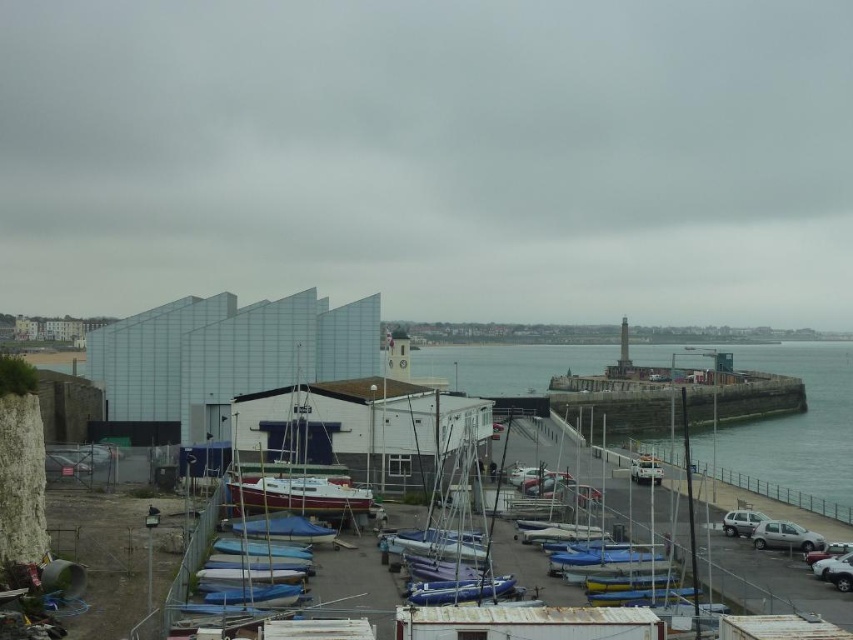
Question: Which point is farther to the camera?

Choices:
 (A) white matte sailboat at center
 (B) clear blue water at center

Answer: (B)

Question: Is white matte sailboat at center bigger than white matte van at center?

Choices:
 (A) no
 (B) yes

Answer: (B)

Question: Does blue plastic sailboat at center come behind silver metallic car at lower right?

Choices:
 (A) no
 (B) yes

Answer: (A)

Question: Estimate the real-world distances between objects in this image. Which object is farther from the satin silver suv at lower right?

Choices:
 (A) white matte sailboat at center
 (B) silver metallic car at lower right

Answer: (A)

Question: Among these objects, which one is nearest to the camera?

Choices:
 (A) white matte van at center
 (B) satin silver suv at lower right
 (C) white matte sailboat at center

Answer: (C)

Question: Does clear blue water at center have a lesser width compared to white matte sailboat at center?

Choices:
 (A) no
 (B) yes

Answer: (A)